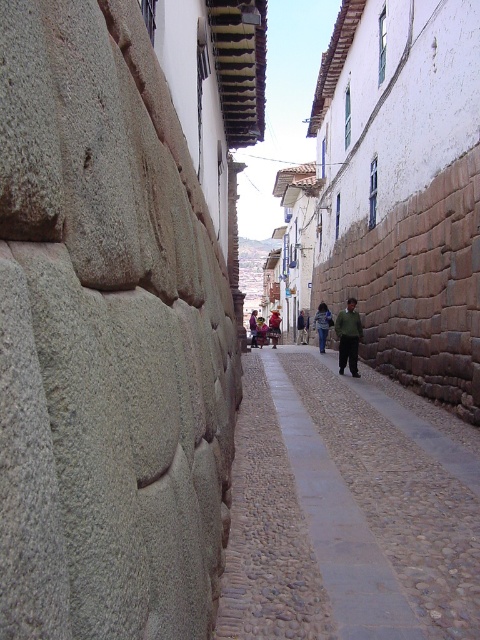
You are standing at the end of the narrow cobblestone street and see the smooth cobblestone pavement at center and the dark green fabric jacket at center. Which object is nearer to you?

The smooth cobblestone pavement at center is closer to the viewer than the dark green fabric jacket at center.